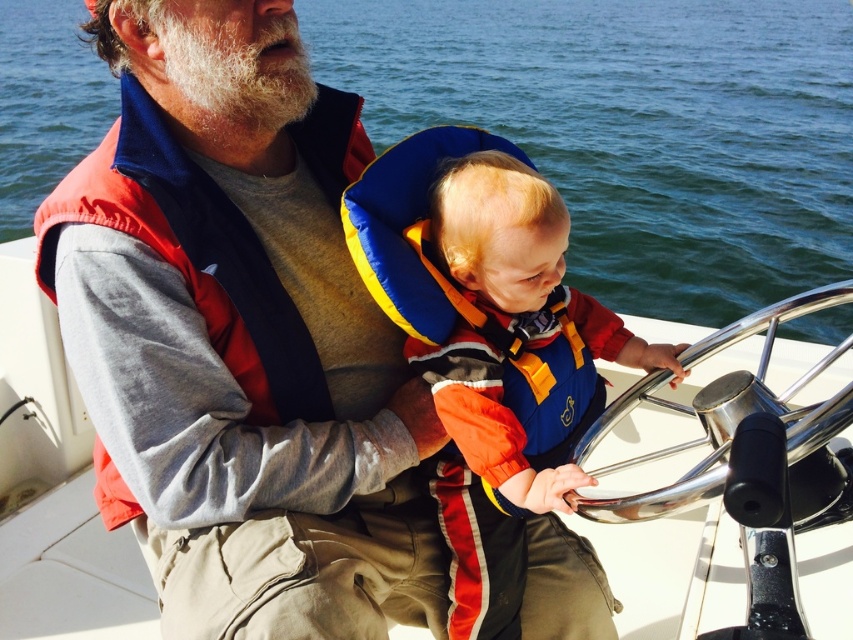
You are standing on the boat and want to reach the point marked at coordinates point (624,621). If your arm can extend 1.5 meters, can you reach it?

The point marked at coordinates point (624,621) is 3.31 meters away from you. Since your arm can only extend 1.5 meters, you cannot reach it.

You are on a boat and need to navigate between two points marked as point (782, 289) and point (62, 392). According to the scene, which point is located further away from the boat operator?

Point (782, 289) is behind point (62, 392), so it is further away from the boat operator.